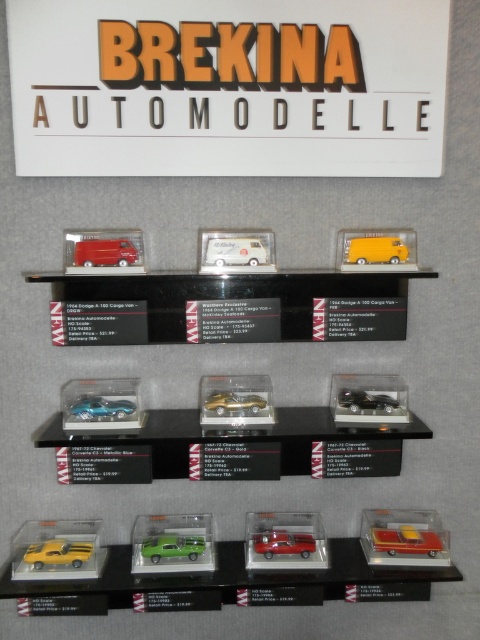
Question: Is white matte van at center thinner than green matte toy car at center?

Choices:
 (A) yes
 (B) no

Answer: (A)

Question: Which point is closer to the camera?

Choices:
 (A) orange plastic sign at upper center
 (B) matte red car at lower right
 (C) gold metallic sports car at center
 (D) green matte toy car at center

Answer: (A)

Question: Is yellow matte toy car at lower left closer to camera compared to matte yellow van at center?

Choices:
 (A) yes
 (B) no

Answer: (B)

Question: Which point appears closest to the camera in this image?

Choices:
 (A) (360, 236)
 (B) (187, 540)
 (C) (242, 256)
 (D) (261, 38)

Answer: (D)

Question: Does metallic blue car at center lie in front of gold metallic sports car at center?

Choices:
 (A) yes
 (B) no

Answer: (A)

Question: Which is farther from the metallic red car at center?

Choices:
 (A) matte red car at lower right
 (B) gold metallic sports car at center
 (C) matte yellow van at center

Answer: (C)